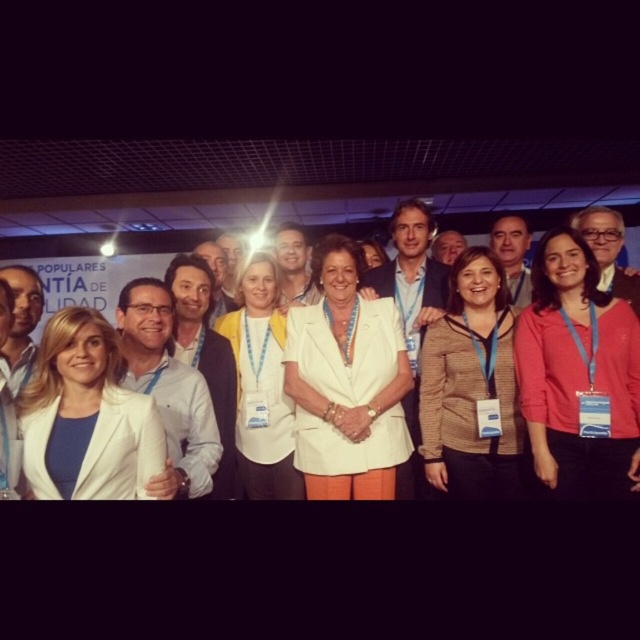
What do you see at coordinates (577, 374) in the screenshot? I see `pink fabric shirt at center` at bounding box center [577, 374].

Does point (534, 371) come farther from viewer compared to point (298, 381)?

No, (534, 371) is closer to viewer.

Is point (609, 352) positioned in front of point (292, 337)?

That is True.

Where is `pink fabric shirt at center`? The height and width of the screenshot is (640, 640). pink fabric shirt at center is located at coordinates (577, 374).

Which is below, white matte blazer at center or white matte blazer at left?

white matte blazer at left

Who is shorter, white matte blazer at center or white matte blazer at left?

white matte blazer at left

Which is behind, point (336, 342) or point (35, 488)?

The point (336, 342) is behind.

Where is `white matte blazer at center`? white matte blazer at center is located at coordinates (346, 384).

Between point (611, 433) and point (268, 394), which one is positioned in front?

Positioned in front is point (611, 433).

Where is `pink fabric shirt at center`? The image size is (640, 640). pink fabric shirt at center is located at coordinates (577, 374).

Where is `pink fabric shirt at center`? pink fabric shirt at center is located at coordinates (577, 374).